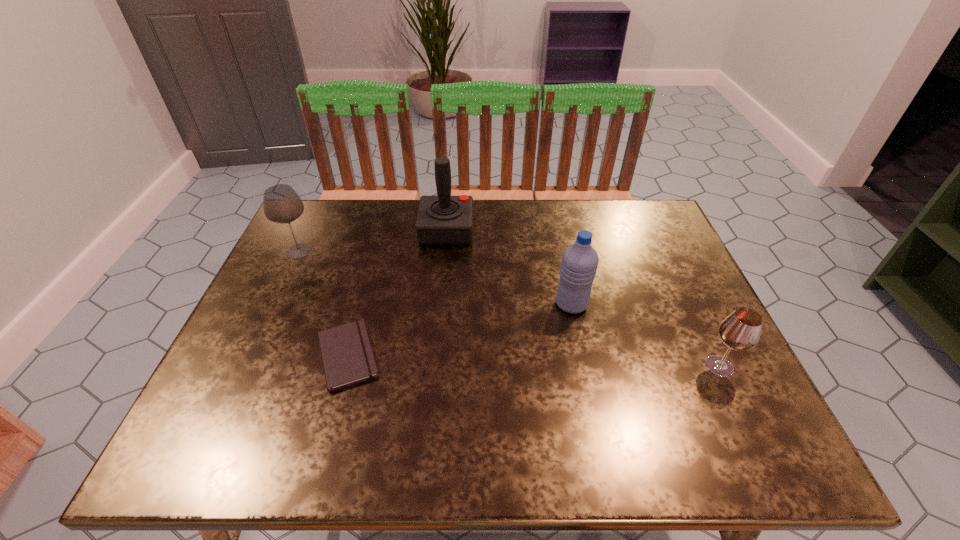
I want to click on vacant area in the image that satisfies the following two spatial constraints: 1. on the front side of the rightmost object; 2. on the right side of the left wineglass, so click(x=245, y=367).

Identify the location of free space that satisfies the following two spatial constraints: 1. on the base of the joystick; 2. on the front side of the taller wineglass. Image resolution: width=960 pixels, height=540 pixels. (444, 251).